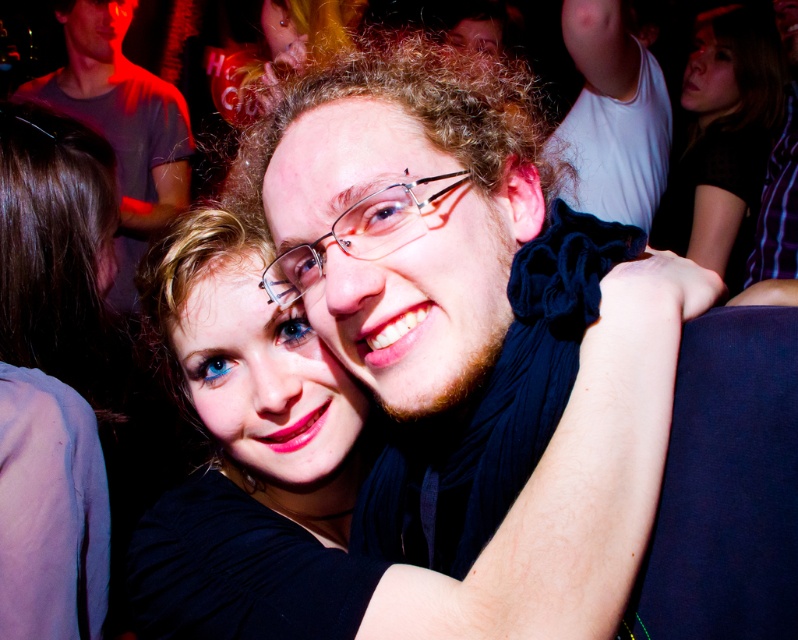
You are a photographer at the event and want to ensure both the matte black scarf at center and the clear plastic glasses at center are visible in your portrait. Since the camera focuses on the closest object, which one might be in focus if you focus on the center?

The matte black scarf at center has a greater height compared to clear plastic glasses at center, so if you focus on the center, the matte black scarf at center is more likely to be in focus because it is taller and occupies more of the central area.